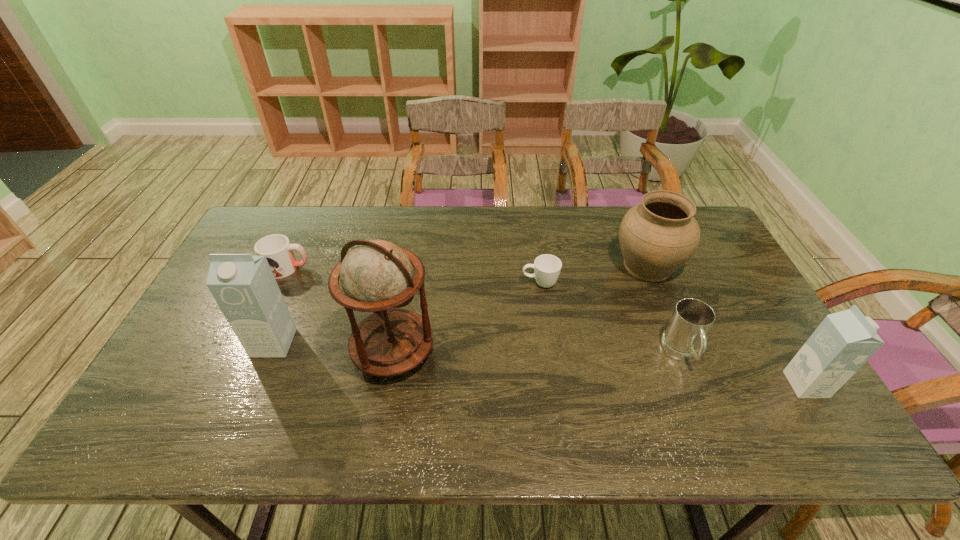
The height and width of the screenshot is (540, 960). In the image, there is a desktop. What are the coordinates of `vacant space at the near edge` in the screenshot? It's located at click(317, 402).

This screenshot has width=960, height=540. In the image, there is a desktop. What are the coordinates of `vacant region at the left edge` in the screenshot? It's located at (216, 362).

This screenshot has width=960, height=540. Identify the location of free point at the right edge. (748, 296).

Image resolution: width=960 pixels, height=540 pixels. I want to click on vacant space at the far left corner of the desktop, so click(260, 229).

This screenshot has width=960, height=540. Find the location of `vacant space at the near left corner of the desktop`. vacant space at the near left corner of the desktop is located at coordinates click(174, 377).

This screenshot has width=960, height=540. Identify the location of free space between the fifth object from right to left and the urn. (520, 308).

Locate an element on the screen. This screenshot has width=960, height=540. vacant point located between the shortest object and the right mug is located at coordinates (611, 318).

Image resolution: width=960 pixels, height=540 pixels. Identify the location of blank region between the urn and the sixth tallest object. click(468, 267).

Identify the location of free space between the farther mug and the nearer carton. (547, 326).

Identify the location of vacant area between the cup and the third object from left to right. The image size is (960, 540). (467, 318).